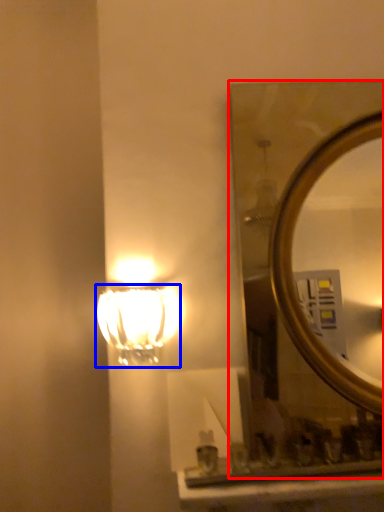
Question: Which point is closer to the camera, mirror (highlighted by a red box) or lamp (highlighted by a blue box)?

Choices:
 (A) mirror
 (B) lamp

Answer: (B)